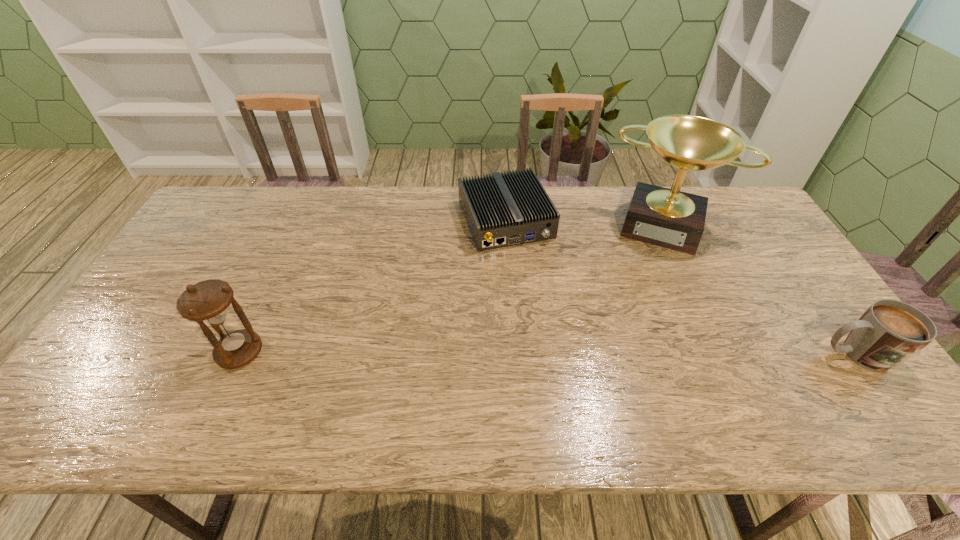
Locate an element on the screen. This screenshot has height=540, width=960. vacant region between the shortest object and the third object from left to right is located at coordinates (587, 222).

At what (x,y) coordinates should I click in order to perform the action: click on free space between the award and the second shortest object. Please return your answer as a coordinate pair (x, y). The height and width of the screenshot is (540, 960). Looking at the image, I should click on [x=761, y=289].

The width and height of the screenshot is (960, 540). Find the location of `free area in between the second object from right to left and the rightmost object`. free area in between the second object from right to left and the rightmost object is located at coordinates (761, 289).

Find the location of a particular element. The height and width of the screenshot is (540, 960). unoccupied position between the tallest object and the third object from right to left is located at coordinates point(587,222).

The width and height of the screenshot is (960, 540). Find the location of `vacant region between the third shortest object and the router`. vacant region between the third shortest object and the router is located at coordinates [372, 286].

Locate an element on the screen. free point between the mug and the second object from right to left is located at coordinates 761,289.

Identify the location of vacant space in between the third object from left to right and the router. (587, 222).

At what (x,y) coordinates should I click in order to perform the action: click on vacant area between the hourglass and the third object from right to left. Please return your answer as a coordinate pair (x, y). The image size is (960, 540). Looking at the image, I should click on (372, 286).

Identify the location of vacant area that lies between the shortest object and the mug. (681, 287).

Locate an element on the screen. This screenshot has width=960, height=540. unoccupied position between the router and the third shortest object is located at coordinates (372, 286).